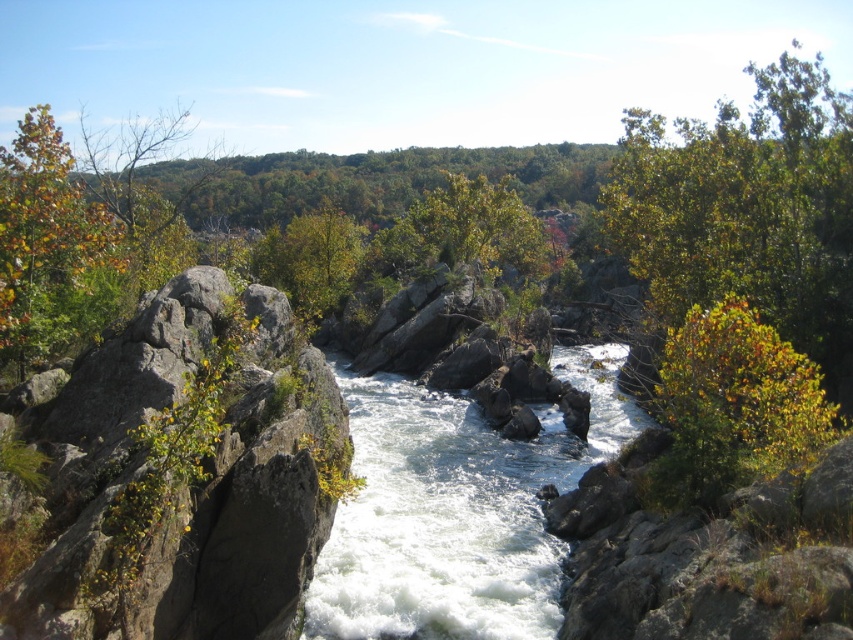
Question: Is gray rough rock at left wider than green leafy tree at center right?

Choices:
 (A) yes
 (B) no

Answer: (A)

Question: Among these points, which one is farthest from the camera?

Choices:
 (A) (695, 340)
 (B) (12, 288)
 (C) (215, 288)
 (D) (611, 368)

Answer: (D)

Question: Estimate the real-world distances between objects in this image. Which object is closer to the white frothy water at center?

Choices:
 (A) green matte tree at left
 (B) gray rough rock at left
 (C) green leafy tree at center right

Answer: (B)

Question: Which object is the closest to the gray rough rock at left?

Choices:
 (A) white frothy water at center
 (B) green matte tree at left

Answer: (B)

Question: Can you confirm if gray rough rock at left is thinner than white frothy water at center?

Choices:
 (A) yes
 (B) no

Answer: (A)

Question: Is white frothy water at center to the left of green leafy tree at center right from the viewer's perspective?

Choices:
 (A) no
 (B) yes

Answer: (B)